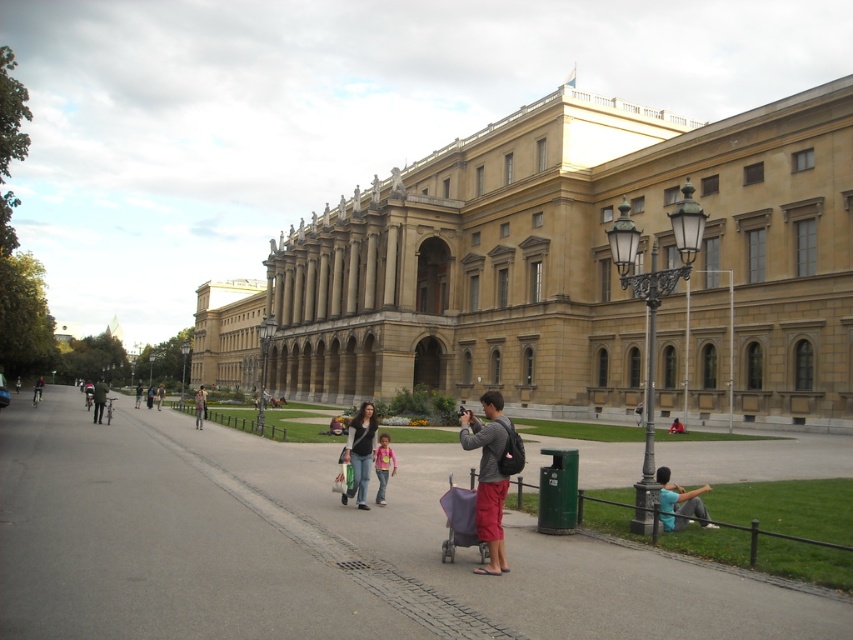
Between golden stone palace at center and dark gray jacket at left, which one appears on the left side from the viewer's perspective?

From the viewer's perspective, dark gray jacket at left appears more on the left side.

Is golden stone palace at center above dark gray jacket at left?

Yes, golden stone palace at center is above dark gray jacket at left.

Which is behind, point (822, 273) or point (100, 417)?

The point (100, 417) is behind.

This screenshot has height=640, width=853. In order to click on golden stone palace at center in this screenshot , I will do `click(569, 268)`.

Between golden stone palace at center and pink fabric jacket at center, which one appears on the right side from the viewer's perspective?

Positioned to the right is pink fabric jacket at center.

Is point (824, 161) more distant than point (384, 465)?

Yes, it is.

Which is in front, point (743, 396) or point (381, 496)?

Point (381, 496) is in front.

The width and height of the screenshot is (853, 640). I want to click on golden stone palace at center, so click(569, 268).

Is point (264, 310) more distant than point (691, 513)?

Yes.

Who is higher up, golden stone palace at center or blue denim jeans at lower right?

golden stone palace at center

Does point (635, 106) come closer to viewer compared to point (671, 525)?

No, (635, 106) is further to viewer.

I want to click on golden stone palace at center, so click(569, 268).